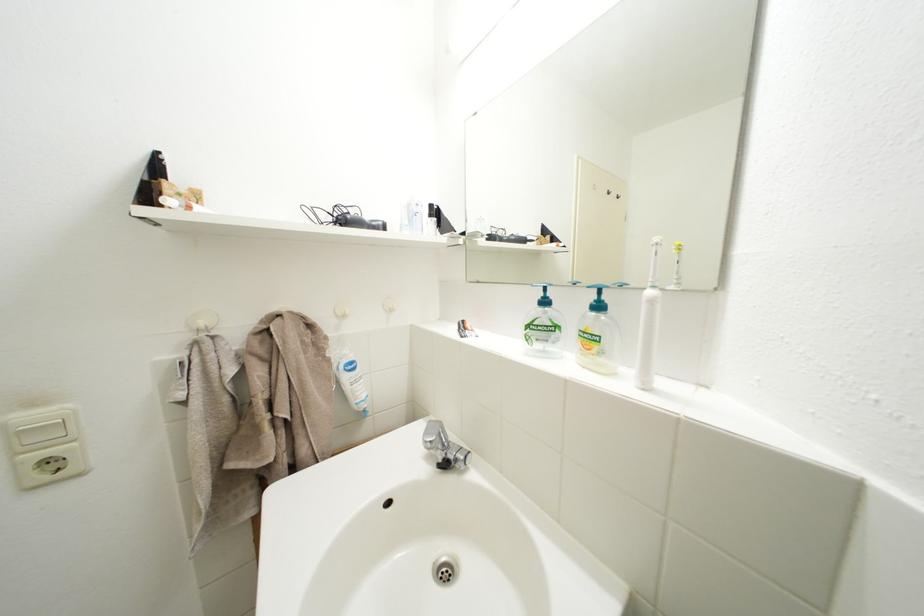
Find where to press the light switch button. Please return your answer as a coordinate pair (x, y).

(42, 428)